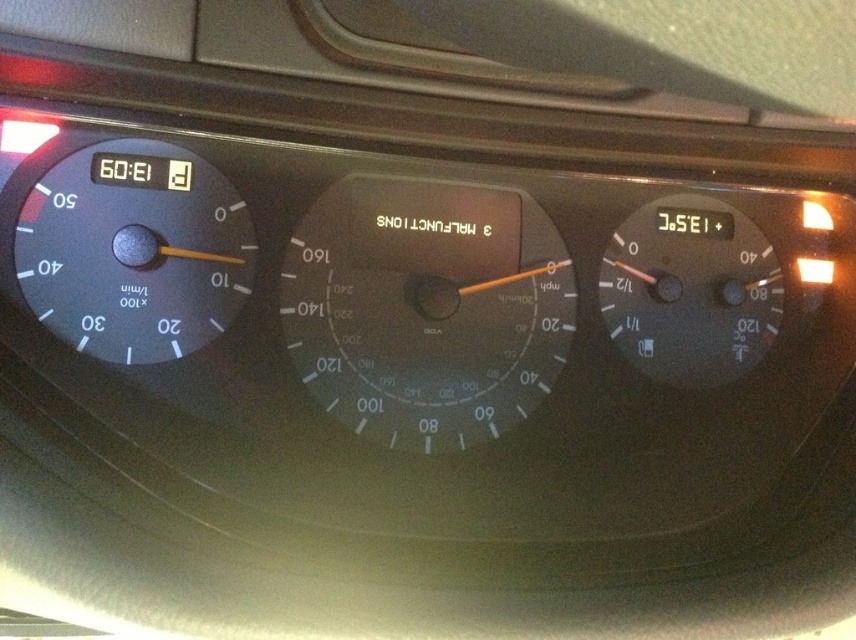
You are driving a car and want to check your speed. You see a transparent glass speedometer at center and a matte black speedometer at right. Which one is closer to the left side of the dashboard?

The transparent glass speedometer at center is closer to the left side of the dashboard than the matte black speedometer at right.

You are driving a car and want to check both the transparent glass speedometer at center and the matte black speedometer at right. Which one do you need to look at to see the car speed?

The transparent glass speedometer at center is the one that displays the car speed because it is the primary speedometer in the center position, while the matte black speedometer at right is likely another gauge such as a tachometer or fuel level indicator.